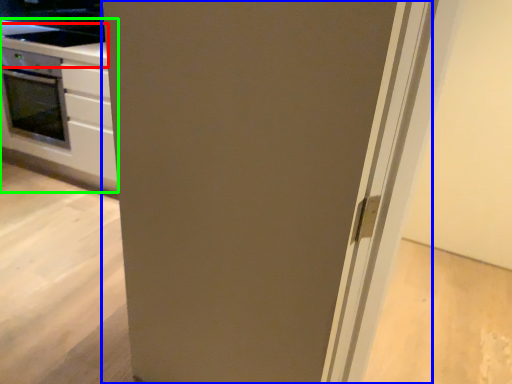
Question: Based on their relative distances, which object is farther from counter top (highlighted by a red box)? Choose from door (highlighted by a blue box) and cabinetry (highlighted by a green box).

Choices:
 (A) door
 (B) cabinetry

Answer: (A)